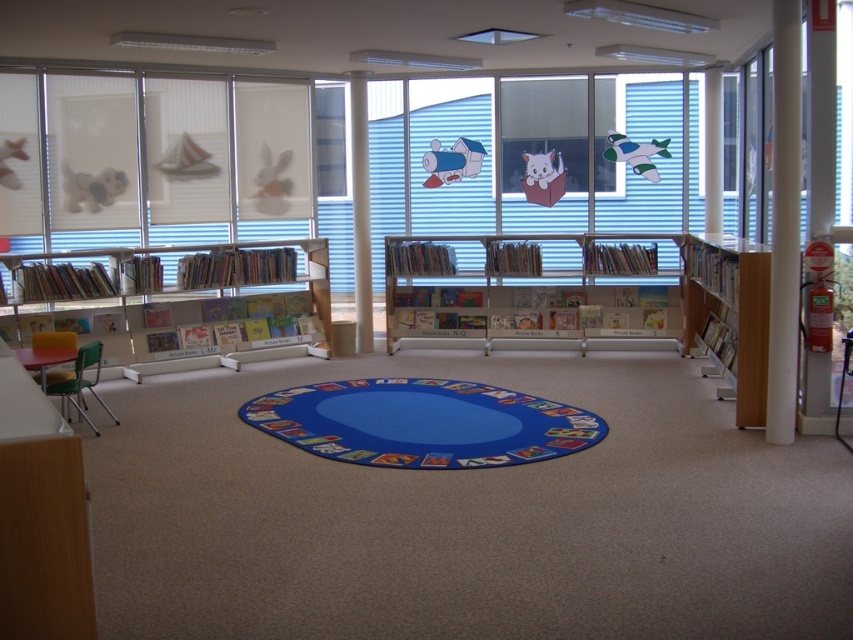
Question: Which is nearer to the matte white teddy bear at left?

Choices:
 (A) blue fabric mat at center
 (B) white matte rabbit at upper center
 (C) white plastic bookshelf at center

Answer: (B)

Question: Is matte plastic mouse at center closer to the viewer compared to white matte sailboat at upper left?

Choices:
 (A) yes
 (B) no

Answer: (B)

Question: Is blue fabric mat at center behind matte white teddy bear at left?

Choices:
 (A) yes
 (B) no

Answer: (B)

Question: Considering the relative positions of white matte sailboat at upper left and soft plush dog at left in the image provided, where is white matte sailboat at upper left located with respect to soft plush dog at left?

Choices:
 (A) right
 (B) left

Answer: (A)

Question: Among these points, which one is farthest from the camera?

Choices:
 (A) (641, 157)
 (B) (166, 150)
 (C) (22, 154)
 (D) (608, 291)

Answer: (A)

Question: Among these points, which one is farthest from the camera?

Choices:
 (A) (532, 314)
 (B) (4, 161)
 (C) (102, 326)
 (D) (722, 346)

Answer: (A)